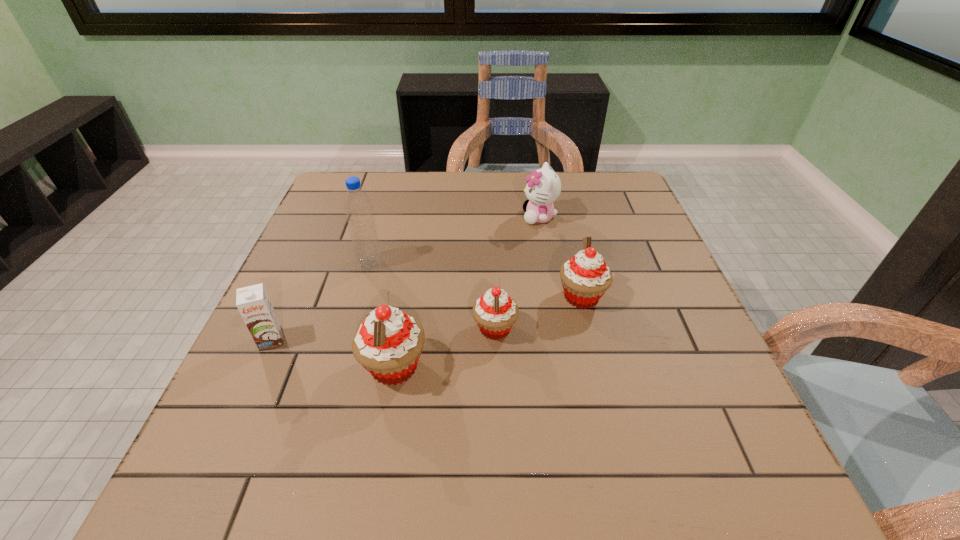
This screenshot has height=540, width=960. Find the location of `the leftmost cupcake`. the leftmost cupcake is located at coordinates (388, 344).

This screenshot has height=540, width=960. I want to click on the third object from right to left, so click(495, 312).

This screenshot has height=540, width=960. I want to click on the second cupcake from left to right, so click(495, 312).

Locate an element on the screen. This screenshot has width=960, height=540. the rightmost cupcake is located at coordinates (585, 277).

Identify the location of the second farthest object. (358, 209).

The image size is (960, 540). Find the location of `the tallest object`. the tallest object is located at coordinates (358, 209).

Where is `kitten`? kitten is located at coordinates (543, 187).

At what (x,y) coordinates should I click in order to perform the action: click on the leftmost object. Please return your answer as a coordinate pair (x, y). The height and width of the screenshot is (540, 960). Looking at the image, I should click on (253, 303).

The height and width of the screenshot is (540, 960). I want to click on free spot located on the right of the fourth object from right to left, so click(x=581, y=367).

You are a GUI agent. You are given a task and a screenshot of the screen. Output one action in this format:
    pyautogui.click(x=<x>, y=<y>)
    Task: Click on the vacant space located 0.290m on the back of the shortest cupcake
    Image resolution: width=960 pixels, height=540 pixels.
    Given the screenshot: What is the action you would take?
    pyautogui.click(x=492, y=232)